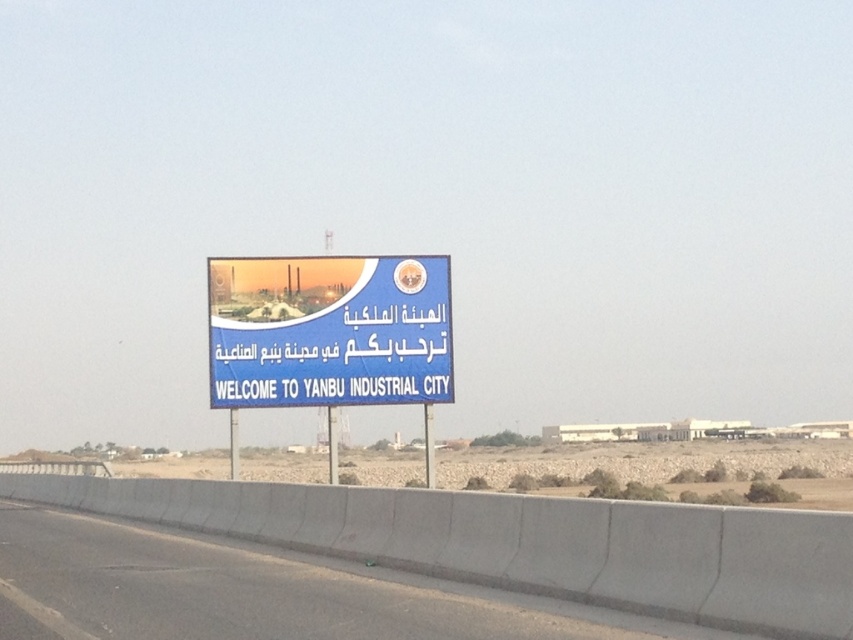
Does gray concrete barrier at lower center appear on the left side of blue plastic signboard at center?

Yes, gray concrete barrier at lower center is to the left of blue plastic signboard at center.

You are a GUI agent. You are given a task and a screenshot of the screen. Output one action in this format:
    pyautogui.click(x=<x>, y=<y>)
    Task: Click on the gray concrete barrier at lower center
    Image resolution: width=853 pixels, height=640 pixels.
    Given the screenshot: What is the action you would take?
    pyautogui.click(x=252, y=589)